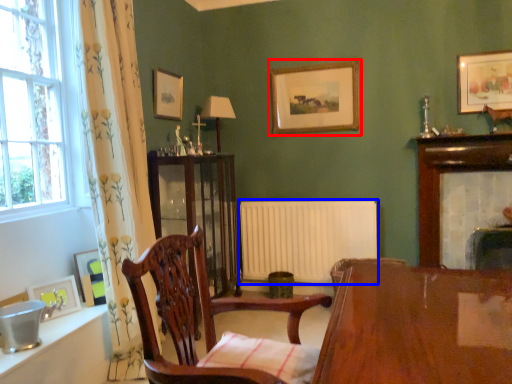
Question: Which of the following is the farthest to the observer, picture frame (highlighted by a red box) or radiator (highlighted by a blue box)?

Choices:
 (A) picture frame
 (B) radiator

Answer: (B)